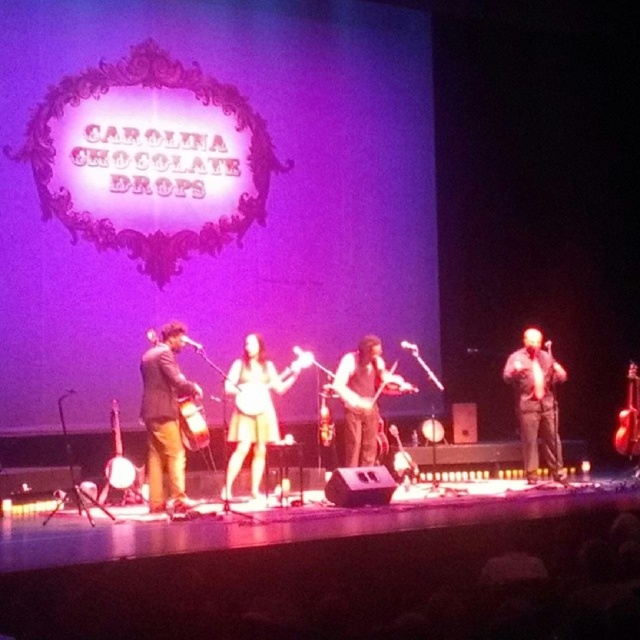
Between brown leather banjo at center and matte wood banjo at center, which one appears on the left side from the viewer's perspective?

From the viewer's perspective, brown leather banjo at center appears more on the left side.

Who is more distant from viewer, (x=170, y=413) or (x=189, y=429)?

The point (x=189, y=429) is more distant.

This screenshot has width=640, height=640. Find the location of `brown leather banjo at center`. brown leather banjo at center is located at coordinates (164, 419).

Is brown leather banjo at center below metallic gold banjo at center?

No, brown leather banjo at center is not below metallic gold banjo at center.

Is brown leather banjo at center thinner than metallic gold banjo at center?

No.

Is point (172, 404) closer to camera compared to point (330, 413)?

Yes.

Locate an element on the screen. brown leather banjo at center is located at coordinates (164, 419).

From the picture: Which is more to the left, brown leather banjo at center or wooden violin at center?

brown leather banjo at center is more to the left.

The width and height of the screenshot is (640, 640). In order to click on brown leather banjo at center in this screenshot , I will do pyautogui.click(x=164, y=419).